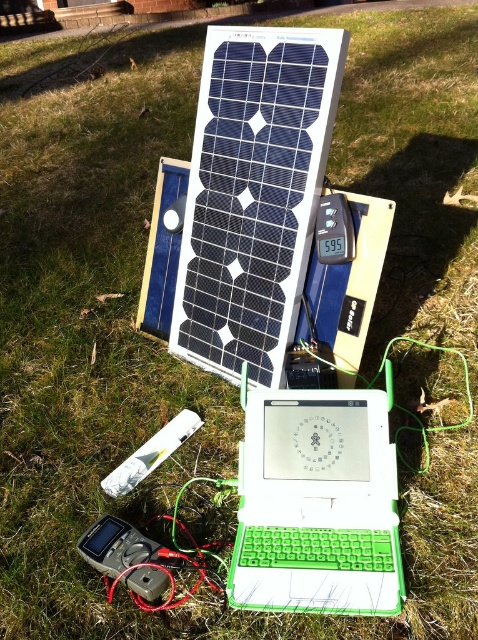
Which is more to the left, green plastic laptop at center or gray plastic multimeter at lower left?

From the viewer's perspective, gray plastic multimeter at lower left appears more on the left side.

Does green plastic laptop at center appear on the right side of gray plastic multimeter at lower left?

Yes, green plastic laptop at center is to the right of gray plastic multimeter at lower left.

What do you see at coordinates (316, 506) in the screenshot? This screenshot has width=478, height=640. I see `green plastic laptop at center` at bounding box center [316, 506].

Find the location of a particular element. The image size is (478, 640). green plastic laptop at center is located at coordinates (316, 506).